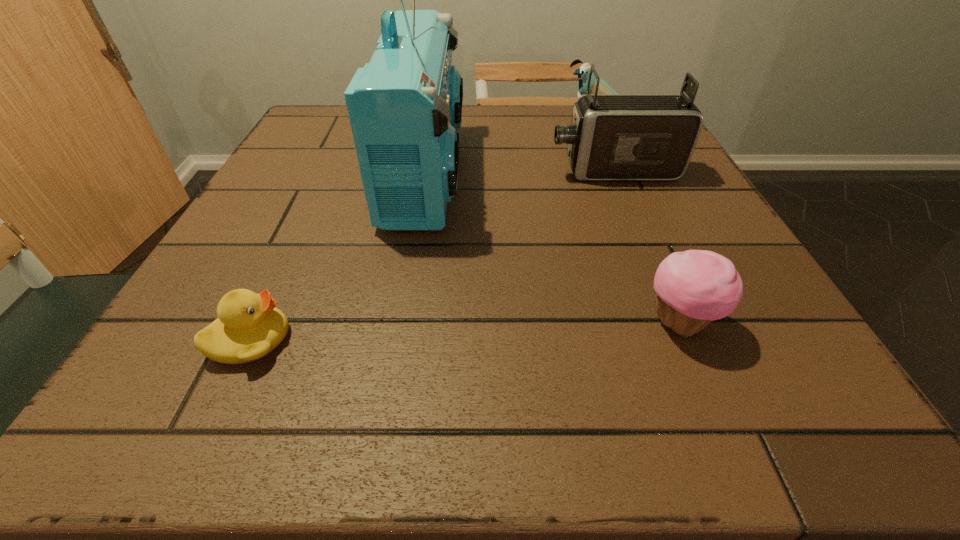
The width and height of the screenshot is (960, 540). In order to click on radio receiver in this screenshot , I will do `click(405, 106)`.

Where is `the tallest object`? The height and width of the screenshot is (540, 960). the tallest object is located at coordinates (405, 106).

The height and width of the screenshot is (540, 960). Identify the location of the second tallest object. (613, 137).

The width and height of the screenshot is (960, 540). I want to click on bird, so click(583, 72).

Where is `the second shortest object`? The image size is (960, 540). the second shortest object is located at coordinates (695, 287).

Where is `the leftmost object`? The width and height of the screenshot is (960, 540). the leftmost object is located at coordinates pos(249,326).

You are a GUI agent. You are given a task and a screenshot of the screen. Output one action in this format:
    pyautogui.click(x=<x>, y=<y>)
    Task: Click on the shortest object
    The width and height of the screenshot is (960, 540).
    Given the screenshot: What is the action you would take?
    pyautogui.click(x=249, y=326)

Locate an element on the screen. vacant space located 0.290m on the front-facing side of the fourth object from right to left is located at coordinates (604, 172).

The width and height of the screenshot is (960, 540). I want to click on blank space located 0.320m at the lens of the second tallest object, so click(x=393, y=171).

I want to click on blank area located 0.180m at the lens of the second tallest object, so click(462, 171).